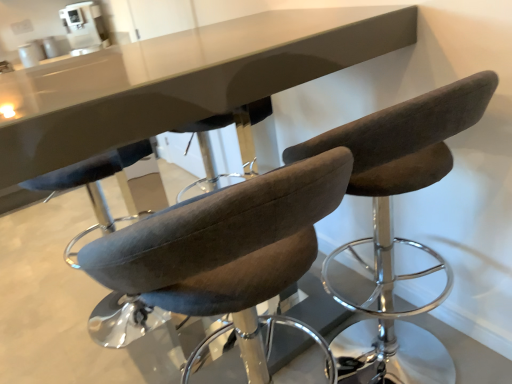
Question: Which direction should I rotate to face dark brown fabric chair at center, acting as the second chair starting from the left, — up or down?

Choices:
 (A) down
 (B) up

Answer: (A)

Question: Are white plastic coffee machine at upper center and velvet brown stool at center, the 1th chair viewed from the left, located far from each other?

Choices:
 (A) no
 (B) yes

Answer: (B)

Question: Can you confirm if white plastic coffee machine at upper center is positioned to the left of velvet brown stool at center, the 1th chair viewed from the left?

Choices:
 (A) no
 (B) yes

Answer: (B)

Question: Does white plastic coffee machine at upper center have a smaller size compared to velvet brown stool at center, the 1th chair viewed from the left?

Choices:
 (A) yes
 (B) no

Answer: (A)

Question: From a real-world perspective, is white plastic coffee machine at upper center over velvet brown stool at center, the 1th chair viewed from the left?

Choices:
 (A) no
 (B) yes

Answer: (B)

Question: Can we say white plastic coffee machine at upper center lies outside velvet brown stool at center, the 2th chair from the right?

Choices:
 (A) yes
 (B) no

Answer: (A)

Question: Is white plastic coffee machine at upper center closer to the viewer compared to velvet brown stool at center, the 1th chair viewed from the left?

Choices:
 (A) yes
 (B) no

Answer: (B)

Question: From the image's perspective, is white plastic coffee machine at upper center located beneath dark brown fabric chair at center, acting as the second chair starting from the left?

Choices:
 (A) yes
 (B) no

Answer: (B)

Question: Would you say white plastic coffee machine at upper center is a long distance from dark brown fabric chair at center, acting as the second chair starting from the left?

Choices:
 (A) yes
 (B) no

Answer: (A)

Question: Does white plastic coffee machine at upper center appear on the left side of dark brown fabric chair at center, acting as the second chair starting from the left?

Choices:
 (A) no
 (B) yes

Answer: (B)

Question: Can you confirm if white plastic coffee machine at upper center is thinner than dark brown fabric chair at center, positioned as the first chair in right-to-left order?

Choices:
 (A) yes
 (B) no

Answer: (A)

Question: Is white plastic coffee machine at upper center further to the viewer compared to dark brown fabric chair at center, positioned as the first chair in right-to-left order?

Choices:
 (A) no
 (B) yes

Answer: (B)

Question: Can you confirm if white plastic coffee machine at upper center is taller than dark brown fabric chair at center, acting as the second chair starting from the left?

Choices:
 (A) no
 (B) yes

Answer: (A)

Question: Could you tell me if velvet brown stool at center, the 1th chair viewed from the left, is facing dark brown fabric chair at center, positioned as the first chair in right-to-left order?

Choices:
 (A) no
 (B) yes

Answer: (A)